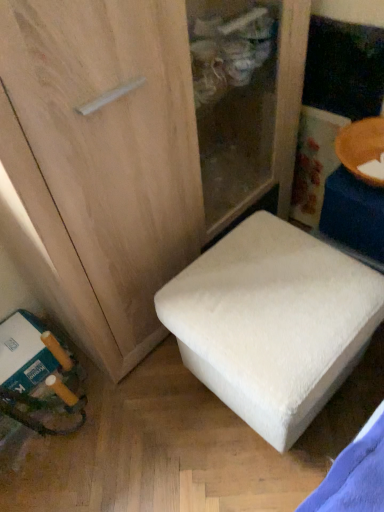
Find the location of a particular element. The height and width of the screenshot is (512, 384). free spot above white fluffy ottoman at center (from a real-world perspective) is located at coordinates (269, 290).